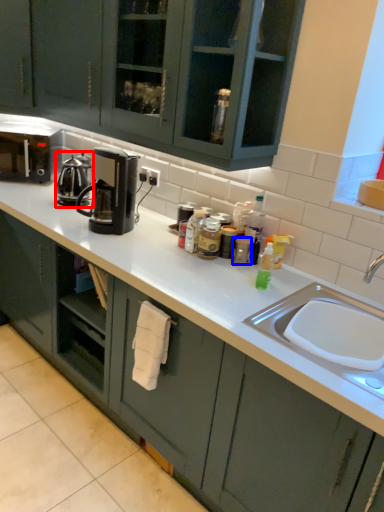
Question: Which point is further to the camera, kitchen appliance (highlighted by a red box) or appliance (highlighted by a blue box)?

Choices:
 (A) kitchen appliance
 (B) appliance

Answer: (A)